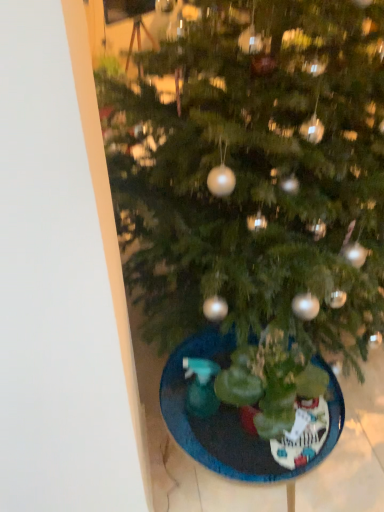
This screenshot has width=384, height=512. What do you see at coordinates (270, 383) in the screenshot? I see `green matte plant at center` at bounding box center [270, 383].

This screenshot has height=512, width=384. Find the location of `green matte plant at center`. green matte plant at center is located at coordinates (270, 383).

Where is `green matte plant at center`? This screenshot has height=512, width=384. green matte plant at center is located at coordinates (270, 383).